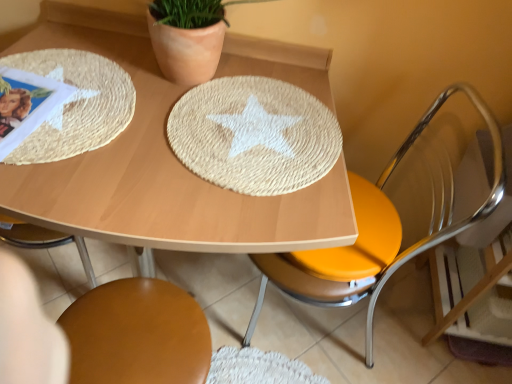
Question: Is metallic yellow seat at right, which ranks as the first chair in right-to-left order, positioned far away from raffia textured placemat at upper left?

Choices:
 (A) no
 (B) yes

Answer: (A)

Question: Considering the relative sizes of metallic yellow seat at right, which ranks as the first chair in right-to-left order, and raffia textured placemat at upper left in the image provided, is metallic yellow seat at right, which ranks as the first chair in right-to-left order, smaller than raffia textured placemat at upper left?

Choices:
 (A) yes
 (B) no

Answer: (B)

Question: Is the depth of metallic yellow seat at right, which ranks as the first chair in right-to-left order, greater than that of raffia textured placemat at upper left?

Choices:
 (A) no
 (B) yes

Answer: (A)

Question: Is metallic yellow seat at right, acting as the second chair starting from the left, wider than raffia textured placemat at upper left?

Choices:
 (A) yes
 (B) no

Answer: (A)

Question: From the image's perspective, would you say metallic yellow seat at right, which ranks as the first chair in right-to-left order, is shown under raffia textured placemat at upper left?

Choices:
 (A) yes
 (B) no

Answer: (A)

Question: Considering their positions, is raffia textured placemat at upper left located in front of or behind brown leather chair at lower center, acting as the first chair starting from the left?

Choices:
 (A) behind
 (B) front

Answer: (B)

Question: From the image's perspective, is raffia textured placemat at upper left located above or below brown leather chair at lower center, acting as the first chair starting from the left?

Choices:
 (A) above
 (B) below

Answer: (A)

Question: Based on their positions, is raffia textured placemat at upper left located to the left or right of brown leather chair at lower center, positioned as the second chair in right-to-left order?

Choices:
 (A) left
 (B) right

Answer: (A)

Question: Is raffia textured placemat at upper left bigger or smaller than brown leather chair at lower center, positioned as the second chair in right-to-left order?

Choices:
 (A) small
 (B) big

Answer: (A)

Question: Is point (159, 175) closer or farther from the camera than point (203, 142)?

Choices:
 (A) closer
 (B) farther

Answer: (A)

Question: From their relative heights in the image, would you say natural fiber placemat at center is taller or shorter than woven straw placemat at center?

Choices:
 (A) short
 (B) tall

Answer: (B)

Question: Is natural fiber placemat at center spatially inside woven straw placemat at center, or outside of it?

Choices:
 (A) outside
 (B) inside

Answer: (A)

Question: Considering the positions of natural fiber placemat at center and woven straw placemat at center in the image, is natural fiber placemat at center bigger or smaller than woven straw placemat at center?

Choices:
 (A) big
 (B) small

Answer: (A)

Question: Is metallic yellow seat at right, acting as the second chair starting from the left, to the left or to the right of brown leather chair at lower center, acting as the first chair starting from the left, in the image?

Choices:
 (A) right
 (B) left

Answer: (A)

Question: From the image's perspective, is metallic yellow seat at right, acting as the second chair starting from the left, above or below brown leather chair at lower center, acting as the first chair starting from the left?

Choices:
 (A) below
 (B) above

Answer: (B)